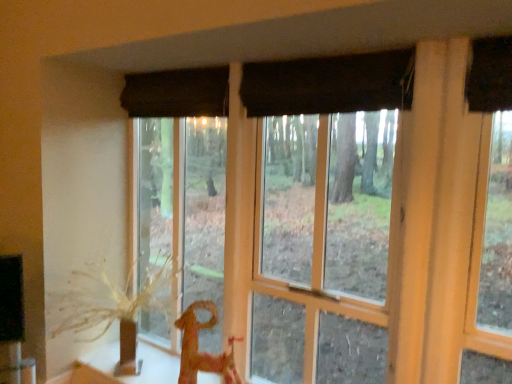
Question: Are wooden horse at lower center and brown textured plant at left far apart?

Choices:
 (A) no
 (B) yes

Answer: (A)

Question: Could you tell me if wooden horse at lower center is facing brown textured plant at left?

Choices:
 (A) no
 (B) yes

Answer: (A)

Question: From the image's perspective, would you say wooden horse at lower center is positioned over brown textured plant at left?

Choices:
 (A) no
 (B) yes

Answer: (A)

Question: Does wooden horse at lower center lie in front of brown textured plant at left?

Choices:
 (A) yes
 (B) no

Answer: (B)

Question: Is wooden horse at lower center oriented away from brown textured plant at left?

Choices:
 (A) no
 (B) yes

Answer: (A)

Question: Considering the relative positions of matte brown curtain at center and black fabric curtain at upper center in the image provided, is matte brown curtain at center to the left or to the right of black fabric curtain at upper center?

Choices:
 (A) left
 (B) right

Answer: (A)

Question: In terms of size, does matte brown curtain at center appear bigger or smaller than black fabric curtain at upper center?

Choices:
 (A) small
 (B) big

Answer: (B)

Question: From a real-world perspective, is matte brown curtain at center above or below black fabric curtain at upper center?

Choices:
 (A) below
 (B) above

Answer: (A)

Question: Considering the positions of matte brown curtain at center and black fabric curtain at upper center in the image, is matte brown curtain at center wider or thinner than black fabric curtain at upper center?

Choices:
 (A) wide
 (B) thin

Answer: (A)

Question: In the image, is wooden horse at lower center on the left side or the right side of matte brown curtain at center?

Choices:
 (A) right
 (B) left

Answer: (B)

Question: From the image's perspective, relative to matte brown curtain at center, is wooden horse at lower center above or below?

Choices:
 (A) below
 (B) above

Answer: (A)

Question: Considering the positions of wooden horse at lower center and matte brown curtain at center in the image, is wooden horse at lower center wider or thinner than matte brown curtain at center?

Choices:
 (A) thin
 (B) wide

Answer: (A)

Question: From a real-world perspective, is wooden horse at lower center physically located above or below matte brown curtain at center?

Choices:
 (A) above
 (B) below

Answer: (B)

Question: Is black fabric curtain at upper center wider or thinner than brown textured plant at left?

Choices:
 (A) thin
 (B) wide

Answer: (A)

Question: In terms of height, does black fabric curtain at upper center look taller or shorter compared to brown textured plant at left?

Choices:
 (A) short
 (B) tall

Answer: (A)